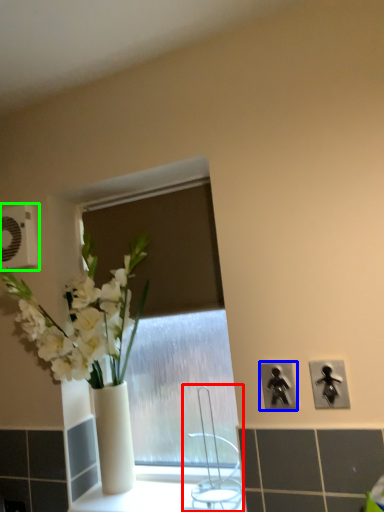
Question: Based on their relative distances, which object is nearer to faucet (highlighted by a red box)? Choose from electric outlet (highlighted by a blue box) and electric outlet (highlighted by a green box).

Choices:
 (A) electric outlet
 (B) electric outlet

Answer: (A)